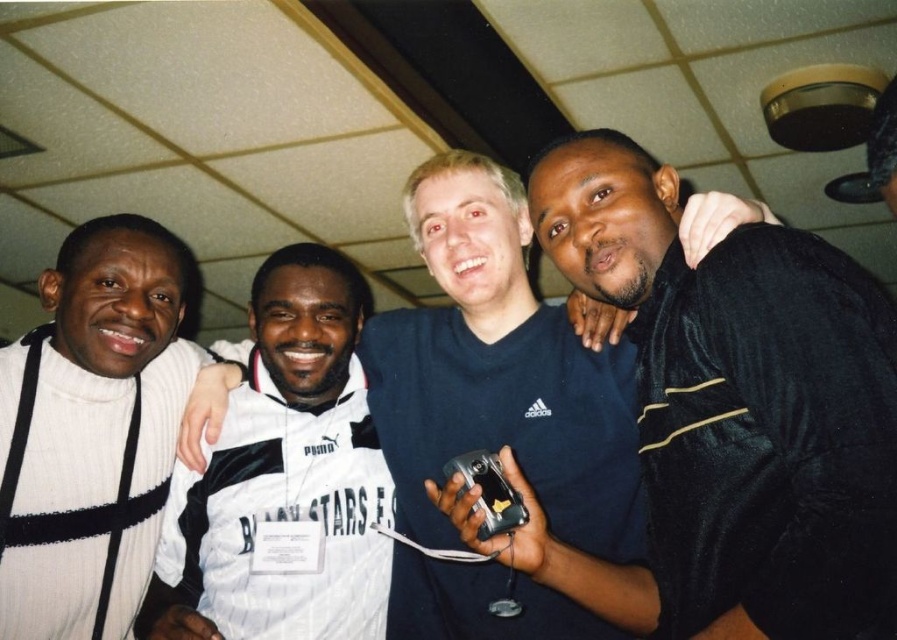
You are a photographer at a social event and need to take a photo of the black matte camera at center and the white striped jersey at center. According to the scene, which object is on the right side when facing the image?

The black matte camera at center is positioned on the right side of the white striped jersey at center.

You are a photographer standing in the center of the room. You want to take a photo of the group but need to adjust your position to ensure the black matte camera at center and the white striped jersey at center are both in frame. Based on their current positions, which direction should you move the camera to include both objects?

The black matte camera at center is positioned over the white striped jersey at center. To include both in the frame, you should move the camera slightly downward so that it captures both the camera and the jersey below it.